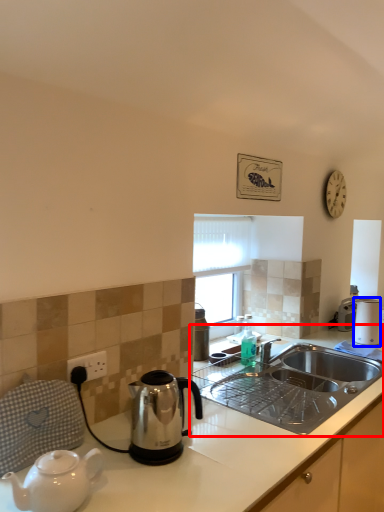
Question: Among these objects, which one is nearest to the camera, countertop (highlighted by a red box) or toaster (highlighted by a blue box)?

Choices:
 (A) countertop
 (B) toaster

Answer: (A)